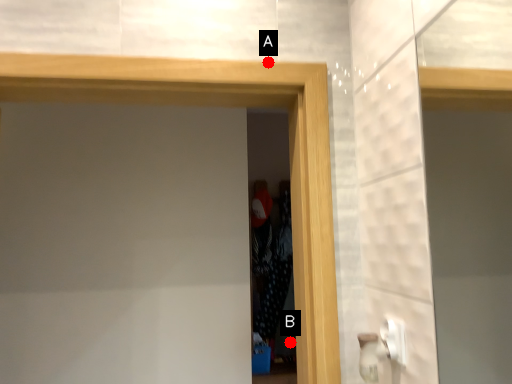
Question: Two points are circled on the image, labeled by A and B beside each circle. Which point is closer to the camera?

Choices:
 (A) A is closer
 (B) B is closer

Answer: (A)